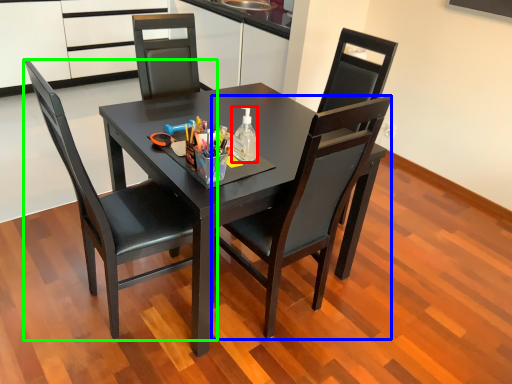
Question: Considering the real-world distances, which object is closest to bottle (highlighted by a red box)? chair (highlighted by a blue box) or chair (highlighted by a green box).

Choices:
 (A) chair
 (B) chair

Answer: (A)